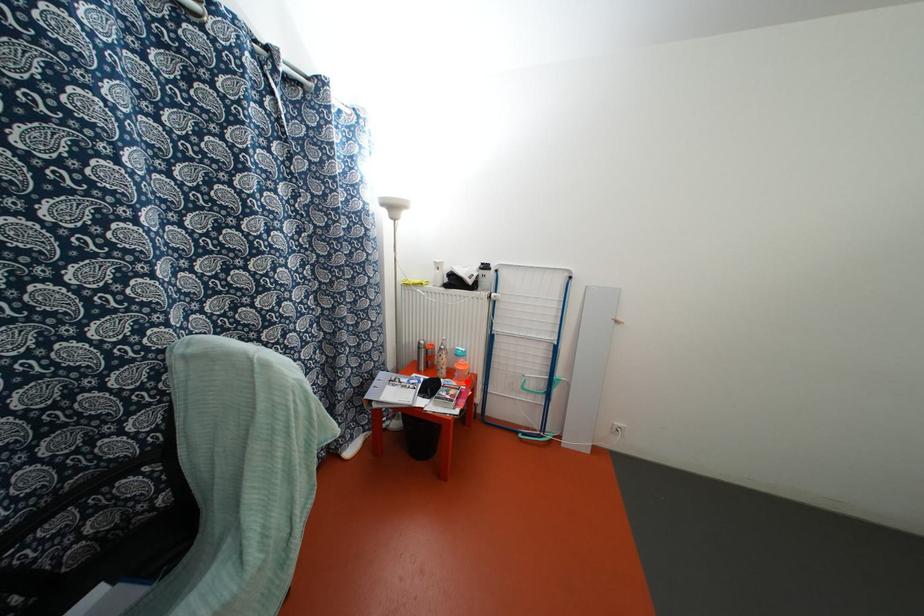
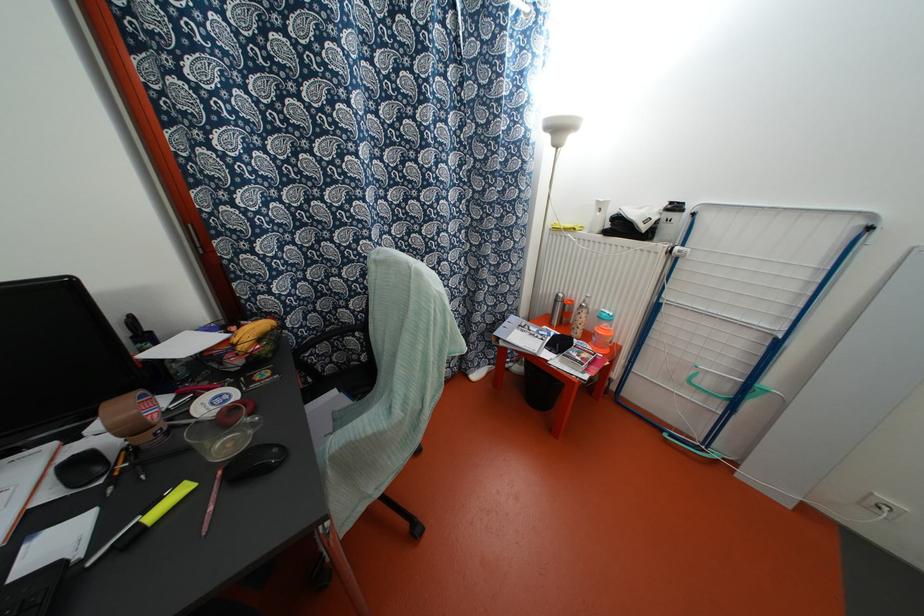
In the second image, find the point that corresponds to the highlighted location in the first image.

(606, 351)